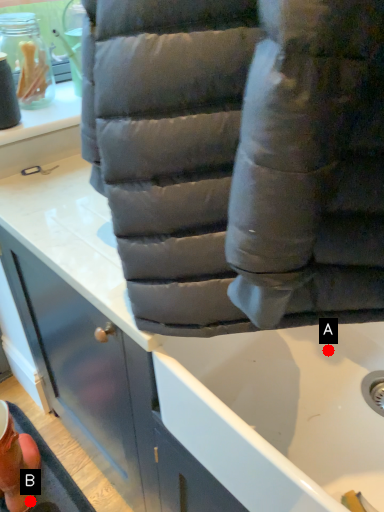
Question: Two points are circled on the image, labeled by A and B beside each circle. Which point is farther to the camera?

Choices:
 (A) A is further
 (B) B is further

Answer: (B)